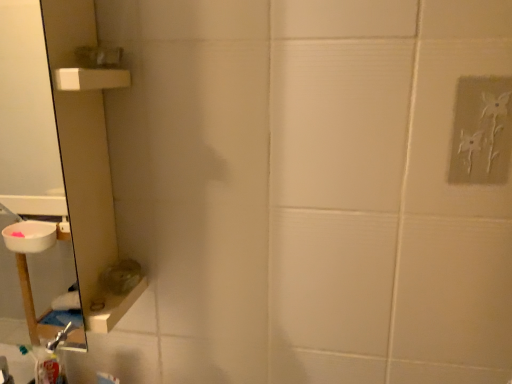
Describe the element at coordinates (481, 131) in the screenshot. I see `white textured light switch at upper right` at that location.

Measure the distance between white textured light switch at upper right and camera.

22.96 inches.

Identify the location of white textured light switch at upper right. (481, 131).

Identify the location of white textured light switch at upper right. (481, 131).